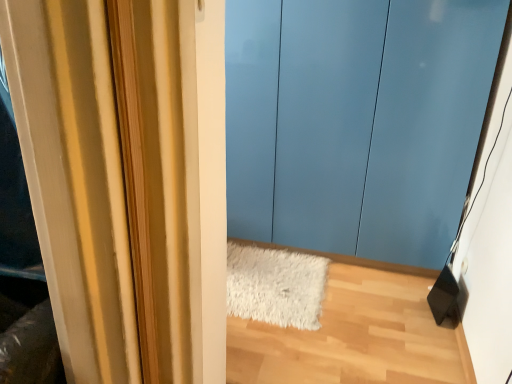
Question: Visually, is glossy blue door at center positioned to the left or to the right of white shaggy rug at lower center?

Choices:
 (A) left
 (B) right

Answer: (B)

Question: From the image's perspective, is glossy blue door at center located above or below white shaggy rug at lower center?

Choices:
 (A) below
 (B) above

Answer: (B)

Question: Looking at their shapes, would you say glossy blue door at center is wider or thinner than white shaggy rug at lower center?

Choices:
 (A) wide
 (B) thin

Answer: (B)

Question: Is white shaggy rug at lower center situated inside glossy blue door at center or outside?

Choices:
 (A) outside
 (B) inside

Answer: (A)

Question: Visually, is white shaggy rug at lower center positioned to the left or to the right of glossy blue door at center?

Choices:
 (A) right
 (B) left

Answer: (B)

Question: From the image's perspective, is white shaggy rug at lower center above or below glossy blue door at center?

Choices:
 (A) above
 (B) below

Answer: (B)

Question: In the image, is white shaggy rug at lower center positioned in front of or behind glossy blue door at center?

Choices:
 (A) front
 (B) behind

Answer: (B)